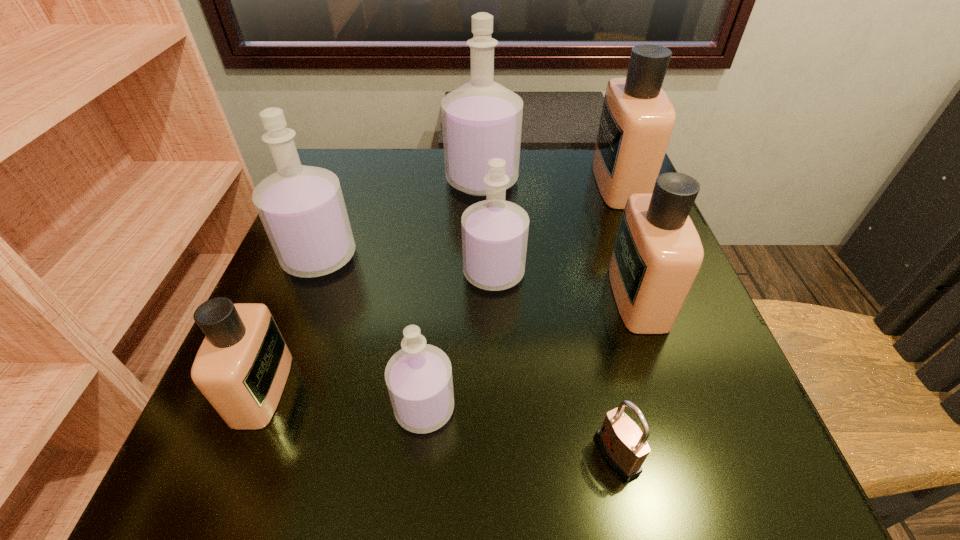
Select which object is the sixth closest to the nearest beige perfume. Please provide its 2D coordinates. Your answer should be formatted as a tuple, i.e. [(x, y)], where the tuple contains the x and y coordinates of a point satisfying the conditions above.

[(657, 254)]

Identify which object is located as the fifth nearest to the shortest object. Please provide its 2D coordinates. Your answer should be formatted as a tuple, i.e. [(x, y)], where the tuple contains the x and y coordinates of a point satisfying the conditions above.

[(302, 209)]

You are a GUI agent. You are given a task and a screenshot of the screen. Output one action in this format:
    pyautogui.click(x=<x>, y=<y>)
    Task: Click on the perfume that stands as the closest to the padlock
    
    Given the screenshot: What is the action you would take?
    pyautogui.click(x=657, y=254)

Identify the location of perfume that can be found as the second closest to the tallest object. Image resolution: width=960 pixels, height=540 pixels. (637, 119).

The height and width of the screenshot is (540, 960). In order to click on purple perfume that is the second closest one to the biggest beige perfume in this screenshot , I will do `click(494, 232)`.

Select which purple perfume appears as the fourth closest to the biggest beige perfume. Please provide its 2D coordinates. Your answer should be formatted as a tuple, i.e. [(x, y)], where the tuple contains the x and y coordinates of a point satisfying the conditions above.

[(419, 380)]

Select which beige perfume appears as the second closest to the tallest object. Please provide its 2D coordinates. Your answer should be formatted as a tuple, i.e. [(x, y)], where the tuple contains the x and y coordinates of a point satisfying the conditions above.

[(657, 254)]

Image resolution: width=960 pixels, height=540 pixels. I want to click on beige perfume that is the closest to the third object from right to left, so click(x=657, y=254).

You are a GUI agent. You are given a task and a screenshot of the screen. Output one action in this format:
    pyautogui.click(x=<x>, y=<y>)
    Task: Click on the free space that satisfies the following two spatial constraints: 1. on the front side of the leftmost purple perfume; 2. on the front label of the leftmost beige perfume
    
    Given the screenshot: What is the action you would take?
    pyautogui.click(x=269, y=389)

Locate an element on the screen. This screenshot has width=960, height=540. free point that satisfies the following two spatial constraints: 1. on the front label of the farthest beige perfume; 2. on the front side of the leftmost purple perfume is located at coordinates (648, 256).